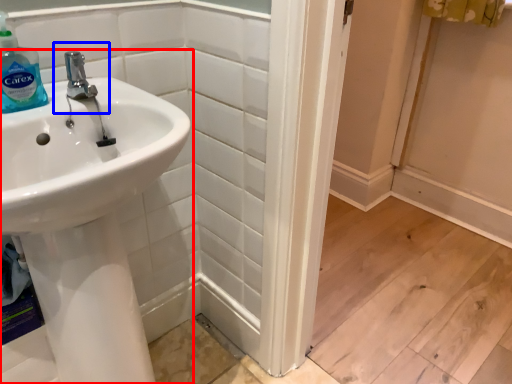
Question: Among these objects, which one is farthest to the camera, sink (highlighted by a red box) or plumbing fixture (highlighted by a blue box)?

Choices:
 (A) sink
 (B) plumbing fixture

Answer: (B)